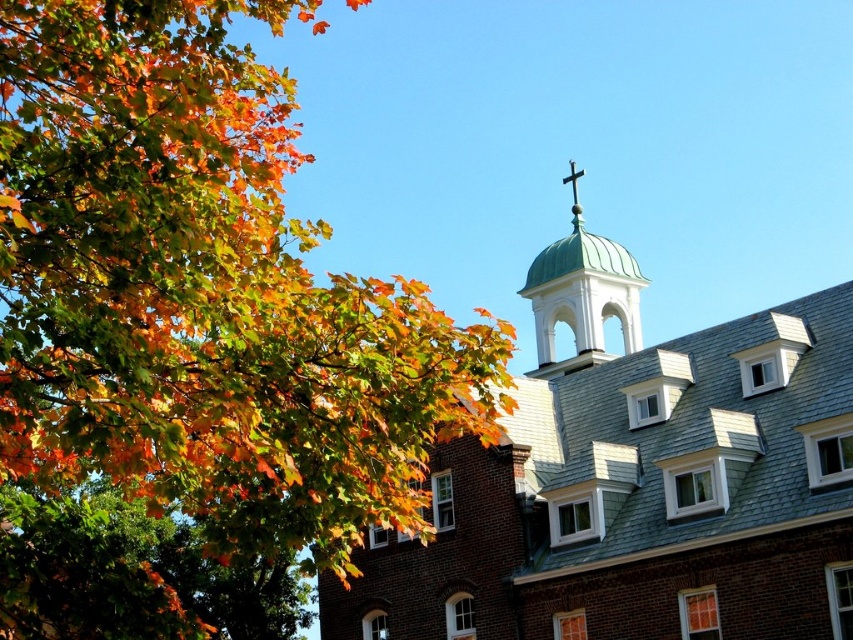
Question: Can you confirm if autumn leaves at upper left is positioned below green dome at upper center?

Choices:
 (A) yes
 (B) no

Answer: (B)

Question: Among these points, which one is farthest from the camera?

Choices:
 (A) (572, 300)
 (B) (137, 163)

Answer: (A)

Question: Is autumn leaves at upper left positioned in front of green copper dome at upper center?

Choices:
 (A) no
 (B) yes

Answer: (B)

Question: Among these objects, which one is farthest from the camera?

Choices:
 (A) autumn leaves at upper left
 (B) green copper dome at upper center
 (C) green dome at upper center

Answer: (B)

Question: Can you confirm if green dome at upper center is positioned to the right of green copper dome at upper center?

Choices:
 (A) no
 (B) yes

Answer: (A)

Question: Which of the following is the closest to the observer?

Choices:
 (A) green dome at upper center
 (B) green copper dome at upper center

Answer: (A)